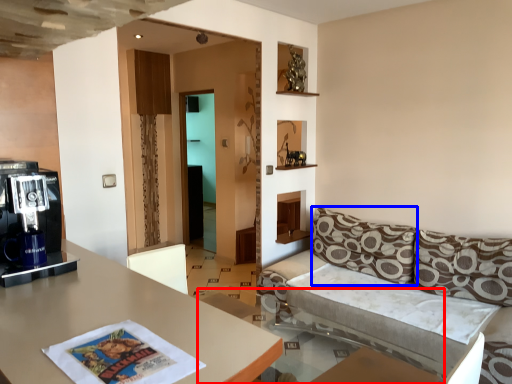
Question: Which of the following is the farthest to the observer, glass table (highlighted by a red box) or pillow (highlighted by a blue box)?

Choices:
 (A) glass table
 (B) pillow

Answer: (B)